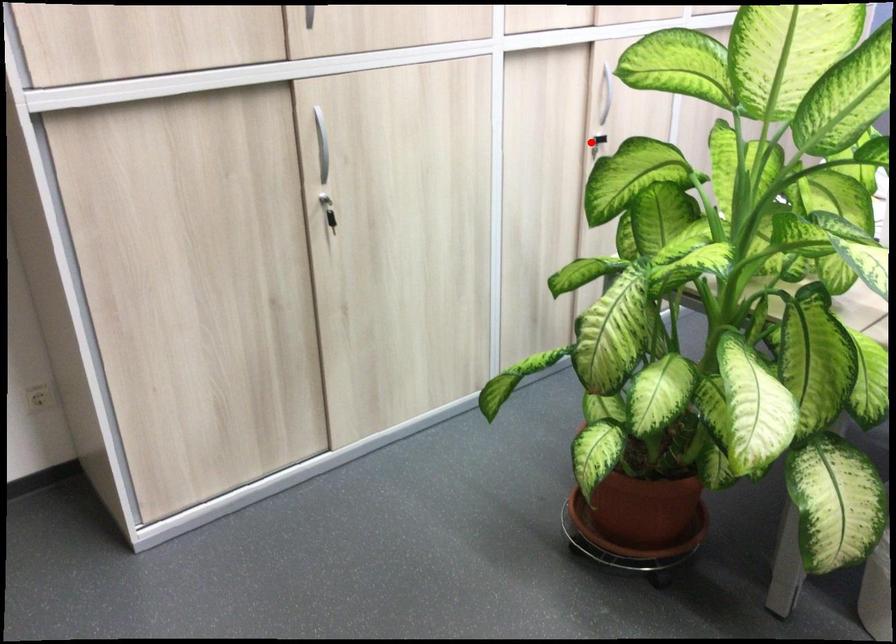
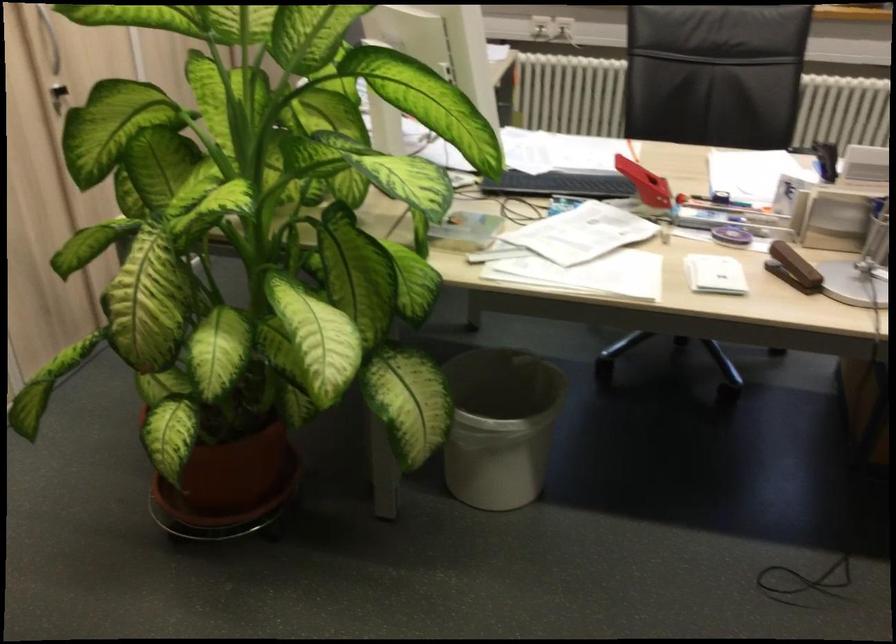
Question: I am providing you with two images of the same scene from different viewpoints. In image1, a red point is highlighted. Considering the same 3D point in image2, which of the following is correct?

Choices:
 (A) It is closer
 (B) It is farther

Answer: (A)